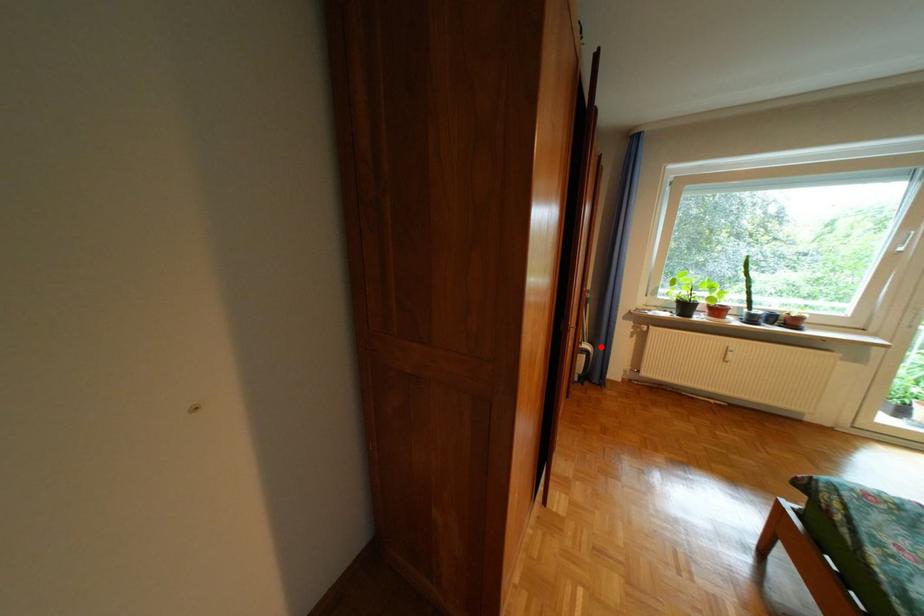
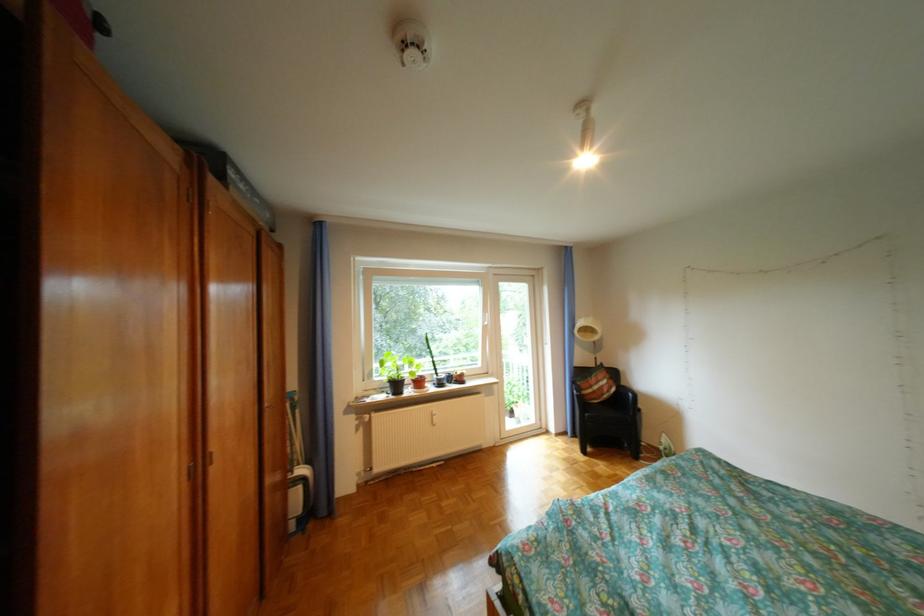
Where in the second image is the point corresponding to the highlighted location from the first image?

(317, 471)